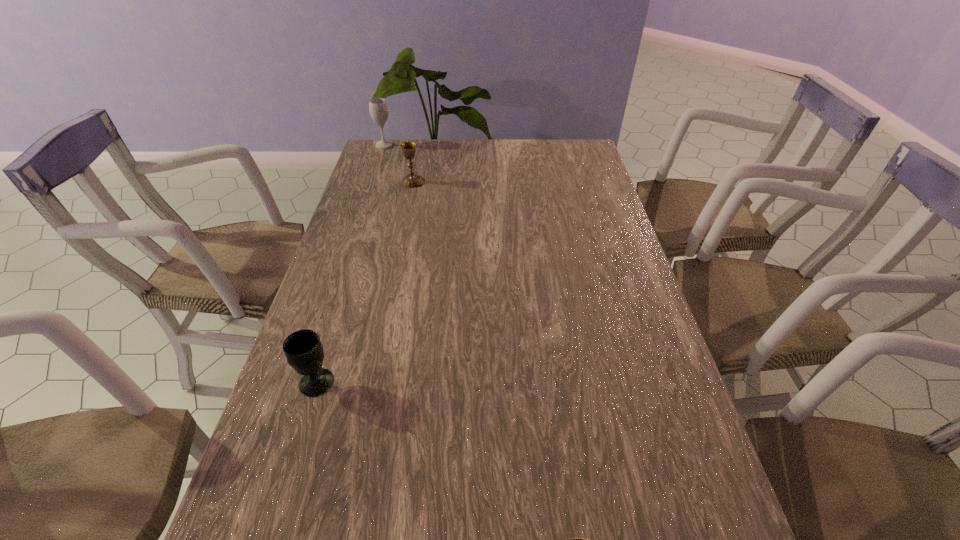
Identify the location of wineglass located in the left edge section of the desktop. The width and height of the screenshot is (960, 540). (378, 108).

Find the location of a particular element. This screenshot has width=960, height=540. object positioned at the far left corner is located at coordinates (378, 108).

What are the coordinates of `free space at the far edge of the desktop` in the screenshot? It's located at (540, 147).

In the image, there is a desktop. At what (x,y) coordinates should I click in order to perform the action: click on free space at the left edge. Please return your answer as a coordinate pair (x, y). This screenshot has width=960, height=540. Looking at the image, I should click on (324, 323).

Identify the location of free region at the right edge of the desktop. The image size is (960, 540). (573, 239).

Locate an element on the screen. vacant space at the far left corner of the desktop is located at coordinates (384, 167).

Find the location of a particular element. The height and width of the screenshot is (540, 960). vacant space at the far right corner is located at coordinates (553, 157).

At what (x,y) coordinates should I click in order to perform the action: click on vacant area that lies between the tallest object and the third object from left to right. Please return your answer as a coordinate pair (x, y). Looking at the image, I should click on (398, 164).

At what (x,y) coordinates should I click in order to perform the action: click on vacant area between the tallest object and the third farthest object. Please return your answer as a coordinate pair (x, y). Image resolution: width=960 pixels, height=540 pixels. Looking at the image, I should click on (350, 264).

At what (x,y) coordinates should I click in order to perform the action: click on free space between the tallest object and the third farthest object. Please return your answer as a coordinate pair (x, y). Looking at the image, I should click on (350, 264).